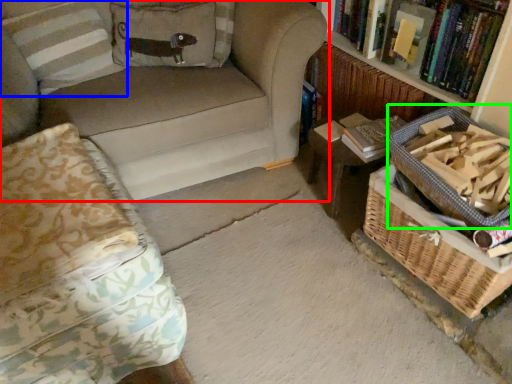
Question: Which is nearer to the studio couch (highlighted by a red box)? pillow (highlighted by a blue box) or basket (highlighted by a green box).

Choices:
 (A) pillow
 (B) basket

Answer: (A)